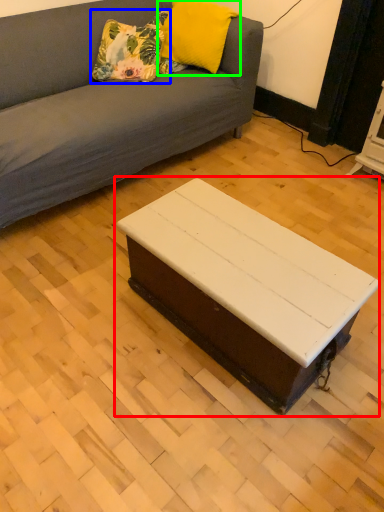
Question: Considering the real-world distances, which object is closest to coffee table (highlighted by a red box)? pillow (highlighted by a blue box) or pillow (highlighted by a green box).

Choices:
 (A) pillow
 (B) pillow

Answer: (A)